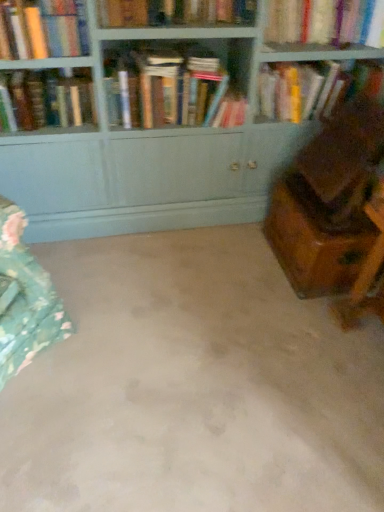
Identify the location of free space to the left of wooden chest at right. The width and height of the screenshot is (384, 512). (235, 263).